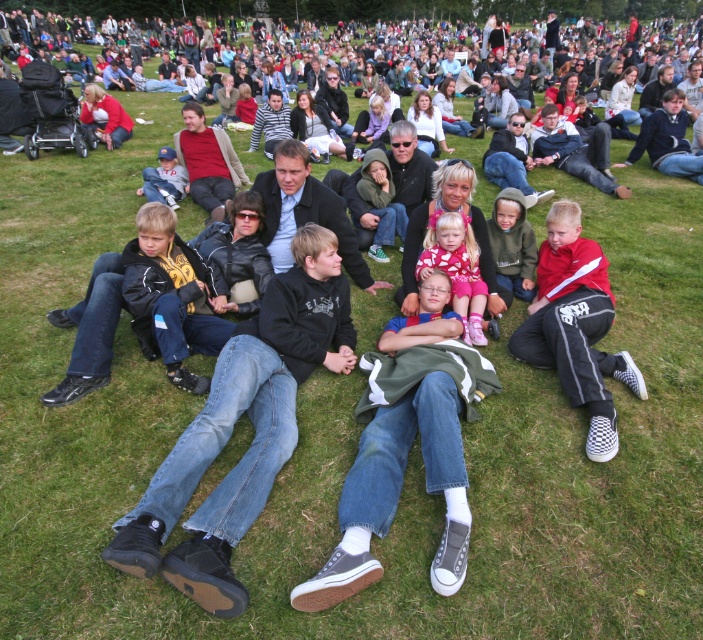
You are a photographer standing at the edge of the grassy field where the lively outdoor gathering is taking place. You want to capture a photo that includes both the pink satin dress at center and the blue denim jeans at center. Given that your camera has a maximum focus range of 12 inches, will you be able to include both subjects in the same frame without moving closer?

The distance between the pink satin dress at center and the blue denim jeans at center is 11.60 inches, which is within the camera maximum focus range of 12 inches. Therefore, you can capture both subjects in the same frame without moving closer.

In the scene shown: You are a photographer trying to capture a candid shot of the blue denim jeans at center and the matte blue cap at center. Since you want to focus on the details of both items, which one should you zoom in on more to ensure clarity?

The blue denim jeans at center is thinner than the matte blue cap at center, so you should zoom in more on the blue denim jeans at center to ensure its details are clear.